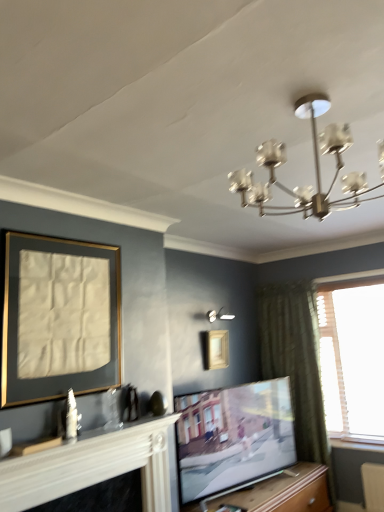
Question: Is matte gold picture frame at left, positioned as the second picture frame in back-to-front order, located within wooden picture frame at upper center, which is the second picture frame in left-to-right order?

Choices:
 (A) no
 (B) yes

Answer: (A)

Question: From the image's perspective, is wooden picture frame at upper center, arranged as the first picture frame when ordered from the bottom, under matte gold picture frame at left, positioned as the second picture frame in back-to-front order?

Choices:
 (A) no
 (B) yes

Answer: (B)

Question: Considering the relative sizes of wooden picture frame at upper center, the first picture frame when ordered from back to front, and matte gold picture frame at left, positioned as the second picture frame in back-to-front order, in the image provided, is wooden picture frame at upper center, the first picture frame when ordered from back to front, bigger than matte gold picture frame at left, positioned as the second picture frame in back-to-front order,?

Choices:
 (A) yes
 (B) no

Answer: (B)

Question: Is wooden picture frame at upper center, placed as the 1th picture frame when sorted from right to left, to the left of matte gold picture frame at left, positioned as the second picture frame in back-to-front order, from the viewer's perspective?

Choices:
 (A) yes
 (B) no

Answer: (B)

Question: Is wooden picture frame at upper center, which is the second picture frame in left-to-right order, beside matte gold picture frame at left, arranged as the first picture frame when viewed from the front?

Choices:
 (A) no
 (B) yes

Answer: (A)

Question: From the image's perspective, is white painted wood fireplace at lower left above or below wooden picture frame at upper center, which is the second picture frame in left-to-right order?

Choices:
 (A) below
 (B) above

Answer: (A)

Question: In the image, is white painted wood fireplace at lower left positioned in front of or behind wooden picture frame at upper center, which is the second picture frame in left-to-right order?

Choices:
 (A) behind
 (B) front

Answer: (B)

Question: In terms of height, does white painted wood fireplace at lower left look taller or shorter compared to wooden picture frame at upper center, the first picture frame when ordered from back to front?

Choices:
 (A) short
 (B) tall

Answer: (B)

Question: In the image, is white painted wood fireplace at lower left on the left side or the right side of wooden picture frame at upper center, arranged as the first picture frame when ordered from the bottom?

Choices:
 (A) right
 (B) left

Answer: (B)

Question: Considering the positions of matte gold picture frame at left, acting as the second picture frame starting from the bottom, and white glossy wall sconce at upper center in the image, is matte gold picture frame at left, acting as the second picture frame starting from the bottom, wider or thinner than white glossy wall sconce at upper center?

Choices:
 (A) thin
 (B) wide

Answer: (A)

Question: Relative to white glossy wall sconce at upper center, is matte gold picture frame at left, which is counted as the 2th picture frame, starting from the right, in front or behind?

Choices:
 (A) behind
 (B) front

Answer: (B)

Question: Is matte gold picture frame at left, which is the first picture frame in top-to-bottom order, to the left or to the right of white glossy wall sconce at upper center in the image?

Choices:
 (A) left
 (B) right

Answer: (A)

Question: From a real-world perspective, is matte gold picture frame at left, positioned as the first picture frame in left-to-right order, physically located above or below white glossy wall sconce at upper center?

Choices:
 (A) above
 (B) below

Answer: (B)

Question: In terms of size, does wooden at center appear bigger or smaller than matte black tv at center?

Choices:
 (A) small
 (B) big

Answer: (B)

Question: Is wooden at center wider or thinner than matte black tv at center?

Choices:
 (A) wide
 (B) thin

Answer: (A)